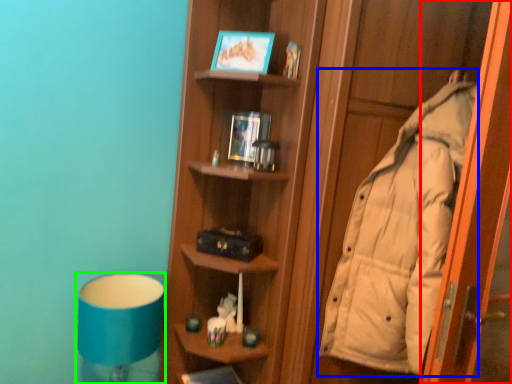
Question: Considering the real-world distances, which object is farthest from screen door (highlighted by a red box)? coat (highlighted by a blue box) or bedside lamp (highlighted by a green box)?

Choices:
 (A) coat
 (B) bedside lamp

Answer: (B)